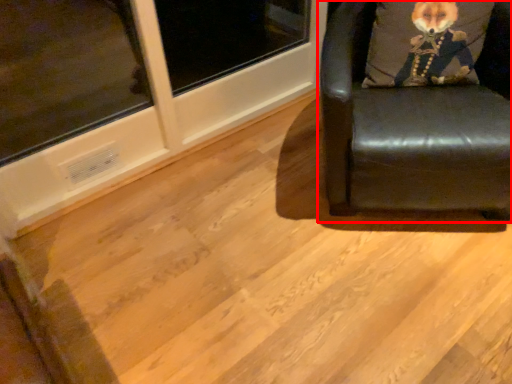
Question: Considering the relative positions of chair (annotated by the red box) and throw pillow in the image provided, where is chair (annotated by the red box) located with respect to the staircase?

Choices:
 (A) right
 (B) left

Answer: (B)